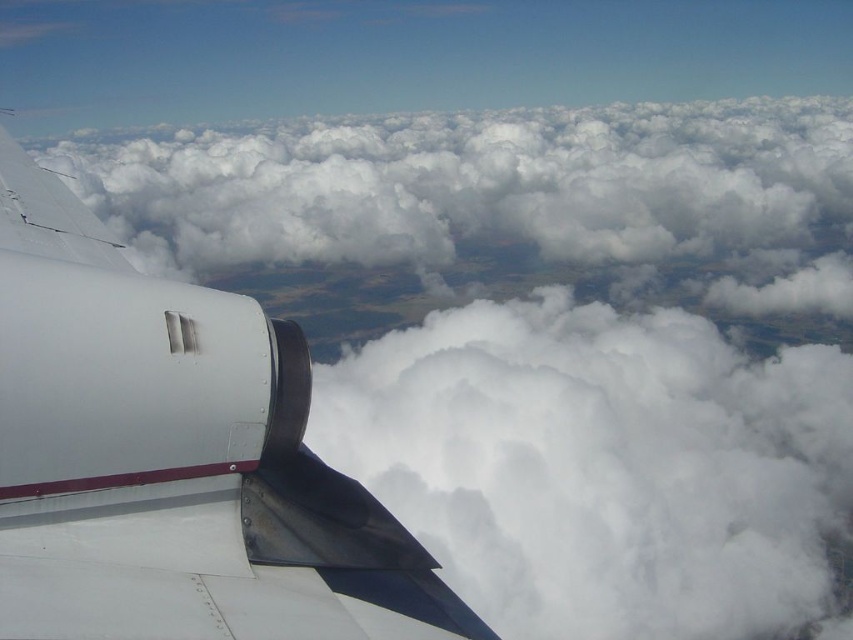
Is point (0, 531) farther from camera compared to point (332, 228)?

No, (0, 531) is closer to viewer.

Is white matte airplane wing at left bigger than white fluffy cloud at upper center?

Incorrect, white matte airplane wing at left is not larger than white fluffy cloud at upper center.

Is point (28, 388) more distant than point (384, 179)?

No, it is not.

Locate an element on the screen. white matte airplane wing at left is located at coordinates (173, 460).

Can you confirm if white fluffy cloud at center is wider than metallic gray winglet at upper left?

Correct, the width of white fluffy cloud at center exceeds that of metallic gray winglet at upper left.

Does white fluffy cloud at center lie in front of metallic gray winglet at upper left?

No, it is behind metallic gray winglet at upper left.

Who is more distant from viewer, (x=668, y=440) or (x=45, y=177)?

Point (x=668, y=440)

At what (x,y) coordinates should I click in order to perform the action: click on white fluffy cloud at center. Please return your answer as a coordinate pair (x, y). The height and width of the screenshot is (640, 853). Looking at the image, I should click on (606, 468).

Does point (48, 598) lie behind point (22, 211)?

No, it is in front of (22, 211).

Can you confirm if white matte airplane wing at left is positioned to the right of metallic gray winglet at upper left?

Yes, white matte airplane wing at left is to the right of metallic gray winglet at upper left.

Is point (20, 428) in front of point (7, 136)?

Yes, it is in front of point (7, 136).

In order to click on white matte airplane wing at left in this screenshot , I will do `click(173, 460)`.